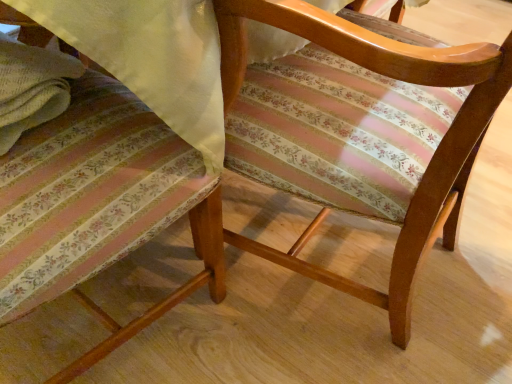
The height and width of the screenshot is (384, 512). In order to click on wooden chair at lower left in this screenshot , I will do `click(101, 204)`.

Describe the element at coordinates (101, 204) in the screenshot. This screenshot has height=384, width=512. I see `wooden chair at lower left` at that location.

What is the approximate width of wooden chair at lower left?

wooden chair at lower left is 13.06 inches in width.

Where is `wooden chair at lower left`? The image size is (512, 384). wooden chair at lower left is located at coordinates coord(101,204).